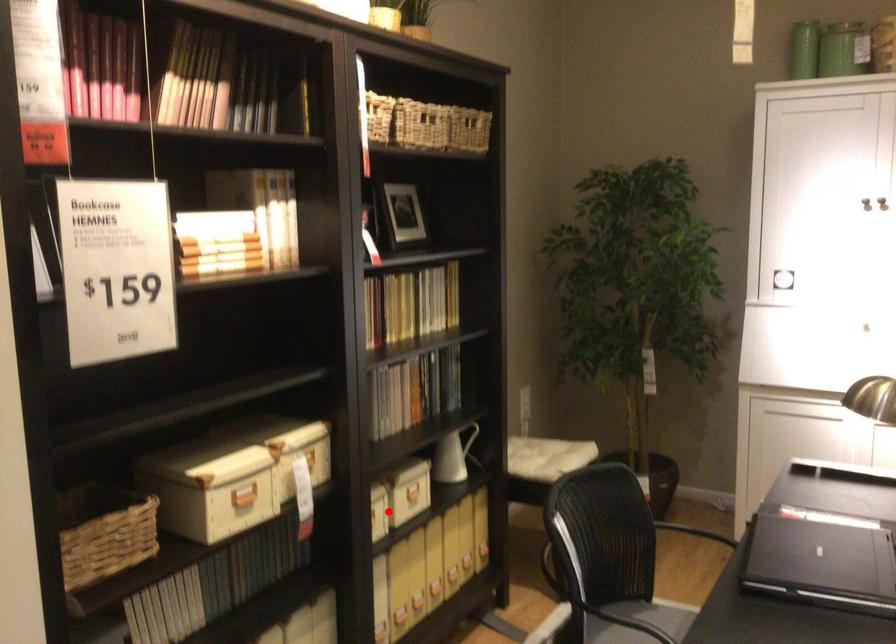
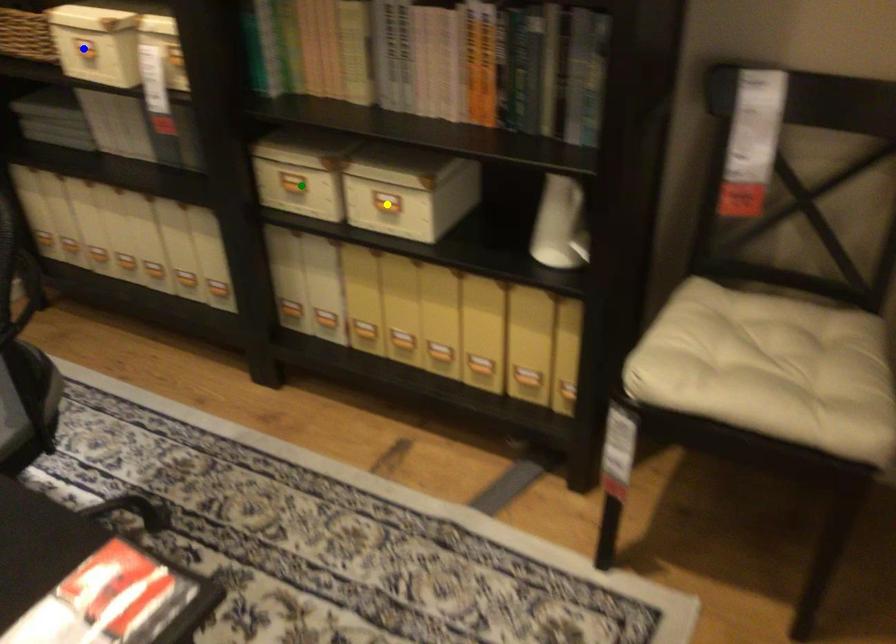
Question: I am providing you with two images of the same scene from different viewpoints. A red point is marked on the first image. You are given multiple points on the second image. Which mark in image 2 goes with the point in image 1?

Choices:
 (A) blue point
 (B) green point
 (C) yellow point

Answer: (C)